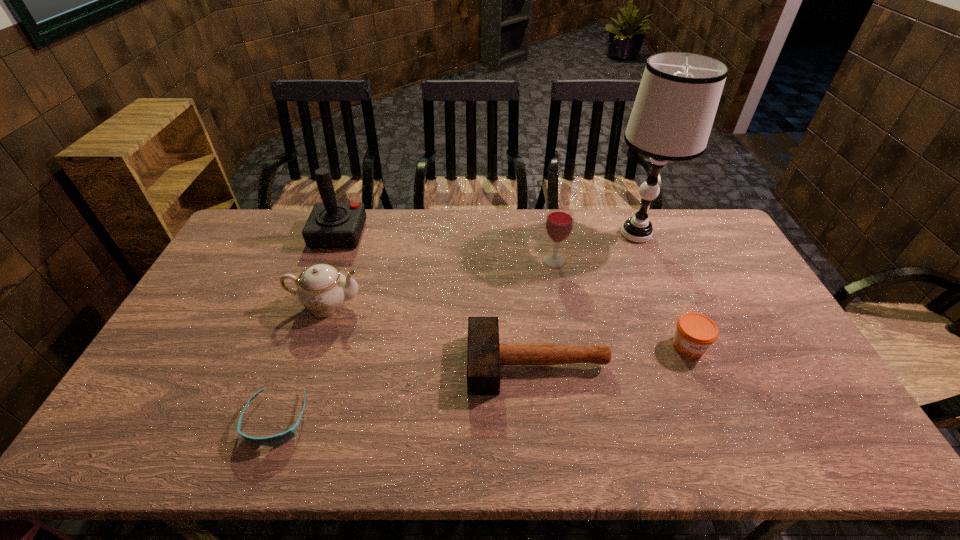
Where is `free location at the near edge`? free location at the near edge is located at coordinates (510, 456).

At what (x,y) coordinates should I click in order to perform the action: click on vacant space at the left edge of the desktop. Please return your answer as a coordinate pair (x, y). Image resolution: width=960 pixels, height=540 pixels. Looking at the image, I should click on (206, 282).

You are a GUI agent. You are given a task and a screenshot of the screen. Output one action in this format:
    pyautogui.click(x=<x>, y=<y>)
    Task: Click on the vacant space at the right edge of the desktop
    Image resolution: width=960 pixels, height=540 pixels.
    Given the screenshot: What is the action you would take?
    point(777,323)

The width and height of the screenshot is (960, 540). Identify the location of vacant space at the far left corner of the desktop. pyautogui.click(x=288, y=211).

This screenshot has height=540, width=960. In order to click on free space at the far right corner of the desktop in this screenshot , I will do [x=669, y=218].

The height and width of the screenshot is (540, 960). Find the location of `empty location between the shortest object and the mallet`. empty location between the shortest object and the mallet is located at coordinates (407, 392).

I want to click on empty space that is in between the third tallest object and the fourth tallest object, so click(x=440, y=282).

What are the coordinates of `free space between the wineglass and the tallest object` in the screenshot? It's located at (595, 247).

Find the location of a particular element. This screenshot has height=540, width=960. free space between the fifth shortest object and the sixth shortest object is located at coordinates (446, 247).

I want to click on free space between the sunglasses and the mallet, so click(x=407, y=392).